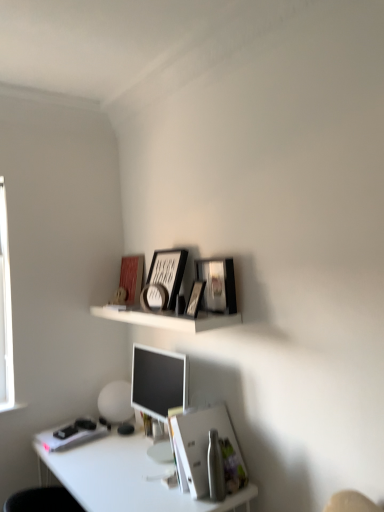
The width and height of the screenshot is (384, 512). What do you see at coordinates (166, 318) in the screenshot?
I see `white matte shelf at upper center` at bounding box center [166, 318].

The height and width of the screenshot is (512, 384). Describe the element at coordinates (217, 284) in the screenshot. I see `matte black picture frame at upper center, which is the 4th picture frame from left to right` at that location.

The height and width of the screenshot is (512, 384). Find the location of `white matte globe at lower left`. white matte globe at lower left is located at coordinates (117, 405).

What do you see at coordinates (117, 405) in the screenshot? I see `white matte globe at lower left` at bounding box center [117, 405].

Identify the location of white matte book at lower left. This screenshot has height=512, width=384. (71, 434).

Find the location of `white matte shelf at upper center`. white matte shelf at upper center is located at coordinates (166, 318).

Is metallic silver picture frame at upper center, which is the 4th picture frame in right-to-left order, located within white matte shelf at upper center?

No.

The width and height of the screenshot is (384, 512). In order to click on shelf that appears on the left of metallic silver picture frame at upper center, which is the 4th picture frame in right-to-left order in this screenshot , I will do `click(166, 318)`.

Between white matte shelf at upper center and metallic silver picture frame at upper center, which is the 4th picture frame in right-to-left order, which one has larger width?

Wider between the two is white matte shelf at upper center.

Who is smaller, white matte shelf at upper center or metallic silver picture frame at upper center, which is the 4th picture frame in right-to-left order?

metallic silver picture frame at upper center, which is the 4th picture frame in right-to-left order.

Is matte black picture frame at upper center, placed as the second picture frame when sorted from right to left, not within white matte shelf at upper center?

Indeed, matte black picture frame at upper center, placed as the second picture frame when sorted from right to left, is completely outside white matte shelf at upper center.

Could you tell me if matte black picture frame at upper center, acting as the third picture frame starting from the left, is facing white matte shelf at upper center?

No, matte black picture frame at upper center, acting as the third picture frame starting from the left, is not aimed at white matte shelf at upper center.

From the image's perspective, is matte black picture frame at upper center, placed as the second picture frame when sorted from right to left, located above or below white matte shelf at upper center?

Based on their image positions, matte black picture frame at upper center, placed as the second picture frame when sorted from right to left, is located above white matte shelf at upper center.

Identify the location of shelf beneath the matte black picture frame at upper center, placed as the second picture frame when sorted from right to left (from a real-world perspective). (166, 318).

Are matte red book cover at upper center and white matte globe at lower left making contact?

No, matte red book cover at upper center is not next to white matte globe at lower left.

From the image's perspective, is matte red book cover at upper center under white matte globe at lower left?

No, from the image's perspective, matte red book cover at upper center is not beneath white matte globe at lower left.

From the image's perspective, is white matte book at lower left on white matte shelf at upper center?

Actually, white matte book at lower left appears below white matte shelf at upper center in the image.

Looking at their sizes, would you say white matte book at lower left is wider or thinner than white matte shelf at upper center?

white matte book at lower left is wider than white matte shelf at upper center.

Is point (92, 425) positioned before point (203, 312)?

No.

Does white matte book at lower left have a greater height compared to white matte shelf at upper center?

No.

Measure the distance between white glossy desk at lower left and matte red book cover at upper center.

white glossy desk at lower left and matte red book cover at upper center are 90.16 centimeters apart.

From the image's perspective, is white glossy desk at lower left located above matte red book cover at upper center?

No, from the image's perspective, white glossy desk at lower left is not above matte red book cover at upper center.

The width and height of the screenshot is (384, 512). What are the coordinates of `book cover behind the white glossy desk at lower left` in the screenshot? It's located at (132, 277).

From a real-world perspective, which is physically below, white glossy desk at lower left or matte red book cover at upper center?

From a 3D spatial view, white glossy desk at lower left is below.

From a real-world perspective, is white paper at lower center positioned above or below matte black picture frame at upper center, placed as the second picture frame when sorted from right to left?

Clearly, from a real-world perspective, white paper at lower center is below matte black picture frame at upper center, placed as the second picture frame when sorted from right to left.

Is white paper at lower center inside the boundaries of matte black picture frame at upper center, placed as the second picture frame when sorted from right to left, or outside?

white paper at lower center cannot be found inside matte black picture frame at upper center, placed as the second picture frame when sorted from right to left.

Which object is thinner, white paper at lower center or matte black picture frame at upper center, placed as the second picture frame when sorted from right to left?

matte black picture frame at upper center, placed as the second picture frame when sorted from right to left, is thinner.

Which is further, (200,434) or (200,291)?

Positioned behind is point (200,291).

From a real-world perspective, is white matte shelf at upper center located beneath matte black picture frame at upper center, the third picture frame when ordered from right to left?

Yes.

From the image's perspective, which is below, white matte shelf at upper center or matte black picture frame at upper center, the third picture frame when ordered from right to left?

white matte shelf at upper center.

From their relative heights in the image, would you say white matte shelf at upper center is taller or shorter than matte black picture frame at upper center, the third picture frame when ordered from right to left?

Clearly, white matte shelf at upper center is shorter compared to matte black picture frame at upper center, the third picture frame when ordered from right to left.

Image resolution: width=384 pixels, height=512 pixels. Find the location of `shelf that appears on the left of metallic silver picture frame at upper center, which appears as the first picture frame when viewed from the left`. shelf that appears on the left of metallic silver picture frame at upper center, which appears as the first picture frame when viewed from the left is located at coordinates (166, 318).

At what (x,y) coordinates should I click in order to perform the action: click on shelf below the matte black picture frame at upper center, placed as the second picture frame when sorted from right to left (from a real-world perspective). Please return your answer as a coordinate pair (x, y). This screenshot has width=384, height=512. Looking at the image, I should click on (166, 318).

Which object lies further to the anchor point matte black picture frame at upper center, acting as the third picture frame starting from the left, matte black picture frame at upper center, the third picture frame when ordered from right to left, or matte black picture frame at upper center, the first picture frame when ordered from right to left?

Among the two, matte black picture frame at upper center, the third picture frame when ordered from right to left, is located further to matte black picture frame at upper center, acting as the third picture frame starting from the left.

Looking at the image, which one is located closer to metallic silver picture frame at upper center, which appears as the first picture frame when viewed from the left, matte red book cover at upper center or white glossy desk at lower left?

The object closer to metallic silver picture frame at upper center, which appears as the first picture frame when viewed from the left, is matte red book cover at upper center.

Based on the photo, estimate the real-world distances between objects in this image. Which object is closer to metallic silver picture frame at upper center, which appears as the first picture frame when viewed from the left, matte black picture frame at upper center, placed as the second picture frame when sorted from right to left, or white paper at lower center?

The object closer to metallic silver picture frame at upper center, which appears as the first picture frame when viewed from the left, is matte black picture frame at upper center, placed as the second picture frame when sorted from right to left.

Estimate the real-world distances between objects in this image. Which object is further from metallic silver picture frame at upper center, which is the 4th picture frame in right-to-left order, matte red book cover at upper center or matte black picture frame at upper center, positioned as the second picture frame in left-to-right order?

Based on the image, matte red book cover at upper center appears to be further to metallic silver picture frame at upper center, which is the 4th picture frame in right-to-left order.

Considering their positions, is matte black picture frame at upper center, which is the 4th picture frame from left to right, positioned closer to white paper at lower center than white matte shelf at upper center?

white matte shelf at upper center lies closer to white paper at lower center than the other object.

Which object lies nearer to the anchor point white matte globe at lower left, metallic silver picture frame at upper center, which appears as the first picture frame when viewed from the left, or white matte shelf at upper center?

white matte shelf at upper center is closer to white matte globe at lower left.

Based on their spatial positions, is white glossy desk at lower left or matte black picture frame at upper center, the first picture frame when ordered from right to left, closer to metallic silver picture frame at upper center, which is the 4th picture frame in right-to-left order?

matte black picture frame at upper center, the first picture frame when ordered from right to left, is closer to metallic silver picture frame at upper center, which is the 4th picture frame in right-to-left order.

Considering their positions, is matte black picture frame at upper center, the third picture frame when ordered from right to left, positioned further to matte black picture frame at upper center, which is the 4th picture frame from left to right, than white matte book at lower left?

white matte book at lower left is further to matte black picture frame at upper center, which is the 4th picture frame from left to right.

What are the coordinates of `shelf that lies between matte red book cover at upper center and white matte book at lower left from top to bottom` in the screenshot? It's located at (166, 318).

I want to click on book cover between matte black picture frame at upper center, the first picture frame when ordered from right to left, and white matte globe at lower left, in the vertical direction, so click(x=132, y=277).

Where is `picture frame between matte black picture frame at upper center, acting as the third picture frame starting from the left, and white paper at lower center from top to bottom`? picture frame between matte black picture frame at upper center, acting as the third picture frame starting from the left, and white paper at lower center from top to bottom is located at coordinates (154, 297).

This screenshot has height=512, width=384. Identify the location of paperback book between matte black picture frame at upper center, placed as the second picture frame when sorted from right to left, and white glossy desk at lower left from top to bottom. (206, 449).